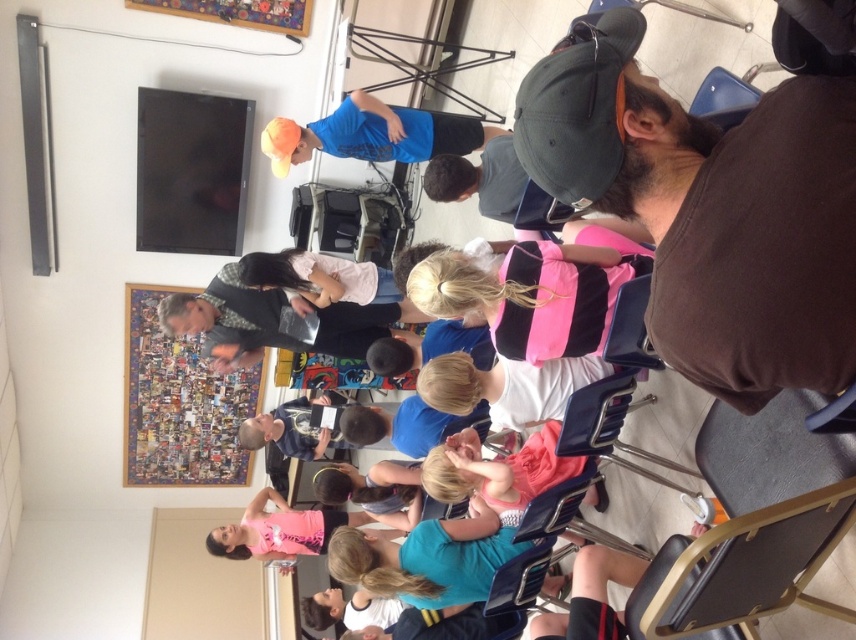
Question: Can you confirm if pink striped vest at center is wider than pink matte tank top at center?

Choices:
 (A) no
 (B) yes

Answer: (A)

Question: Which point is closer to the camera taking this photo?

Choices:
 (A) (435, 480)
 (B) (337, 412)

Answer: (A)

Question: Can you confirm if pink striped vest at center is positioned to the left of blue fabric shirt at center?

Choices:
 (A) no
 (B) yes

Answer: (A)

Question: Which point appears farthest from the camera in this image?

Choices:
 (A) (272, 128)
 (B) (241, 426)
 (C) (545, 435)

Answer: (B)

Question: Observing the image, what is the correct spatial positioning of pink matte tank top at center in reference to matte blue shirt at center?

Choices:
 (A) above
 (B) below

Answer: (B)

Question: Which object is the farthest from the pink matte tank top at center?

Choices:
 (A) pink fabric dress at center
 (B) brown matte shirt at upper right

Answer: (B)